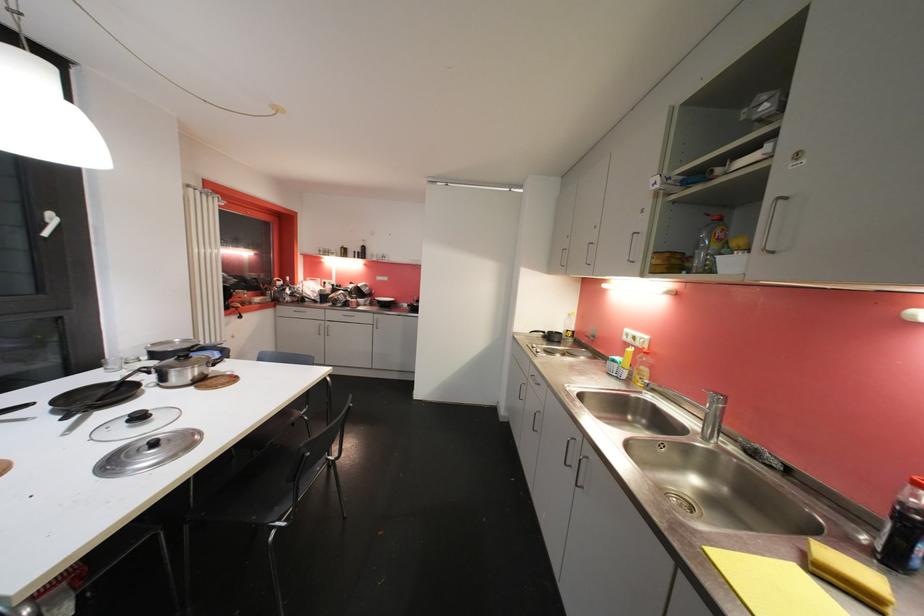
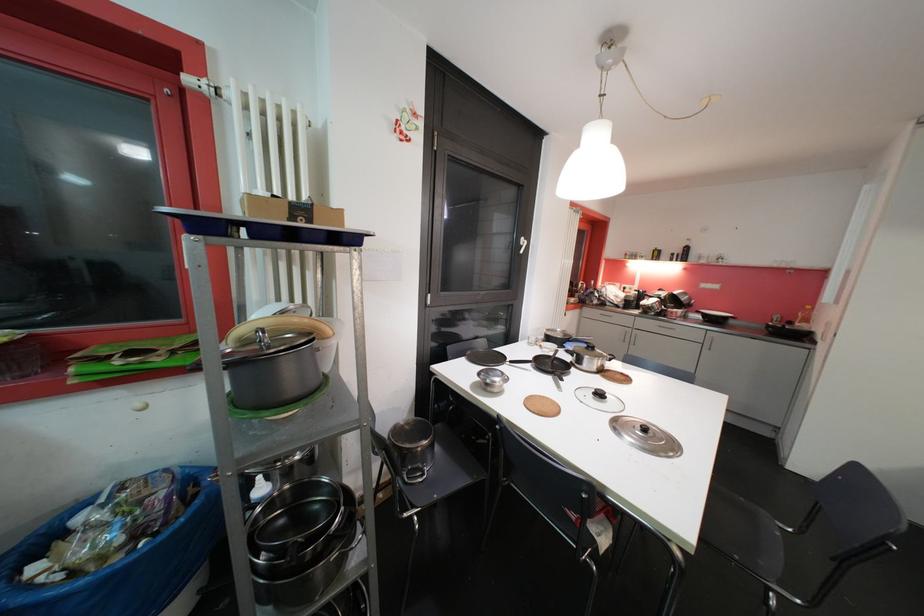
Find the pixel in the second image that matches point (144, 419) in the first image.

(604, 397)